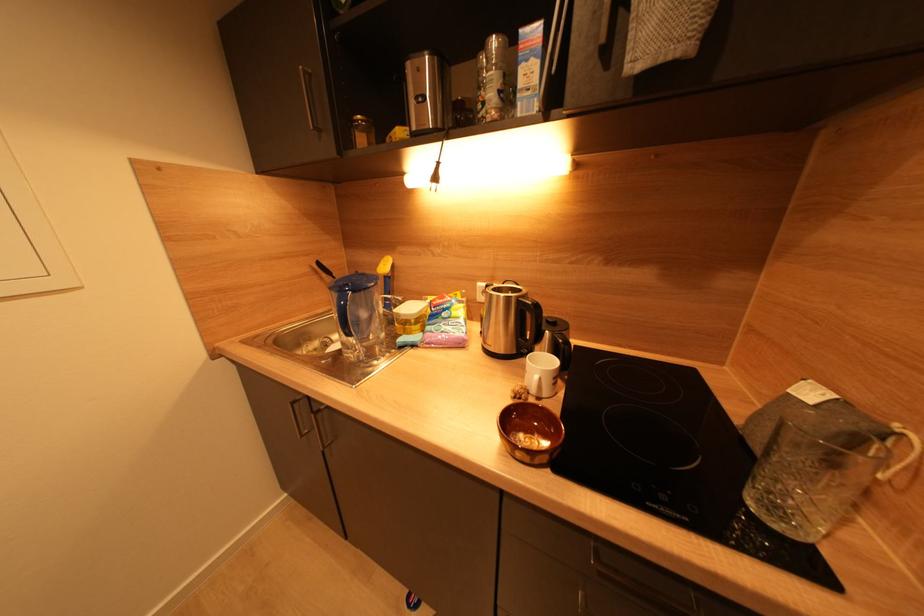
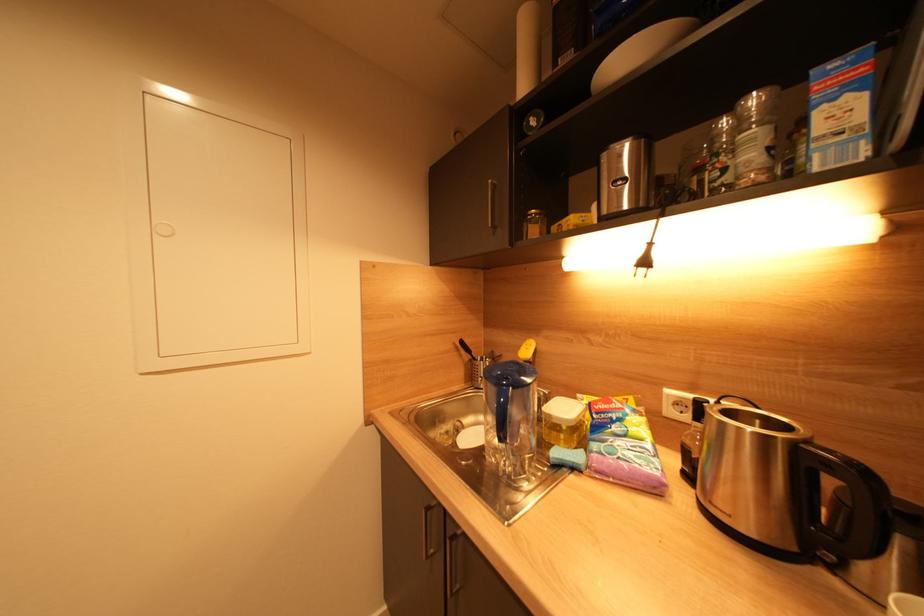
Question: How did the camera likely rotate?

Choices:
 (A) Left
 (B) Right
 (C) Up
 (D) Down

Answer: (A)